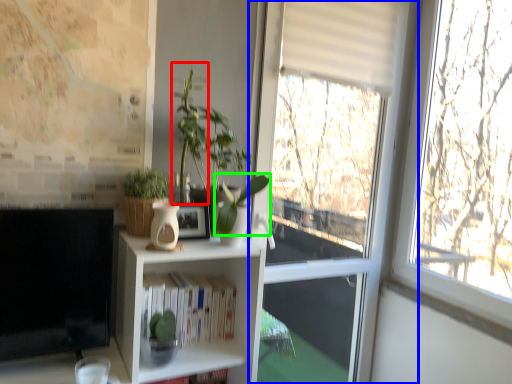
Question: Which is farther away from plant (highlighted by a red box)? window (highlighted by a blue box) or plant (highlighted by a green box)?

Choices:
 (A) window
 (B) plant

Answer: (A)